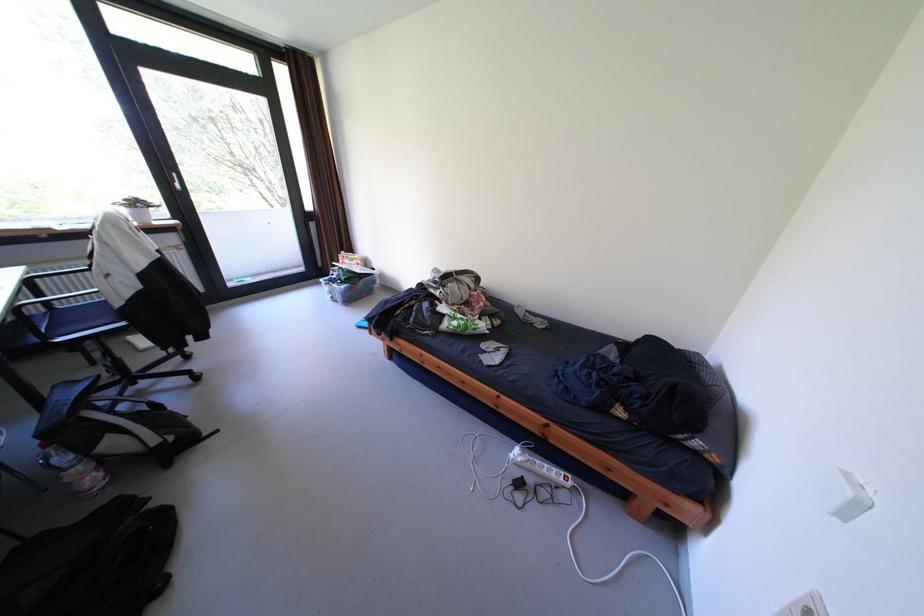
This screenshot has width=924, height=616. What are the coordinates of `black chair armrest` in the screenshot? It's located at (18, 337).